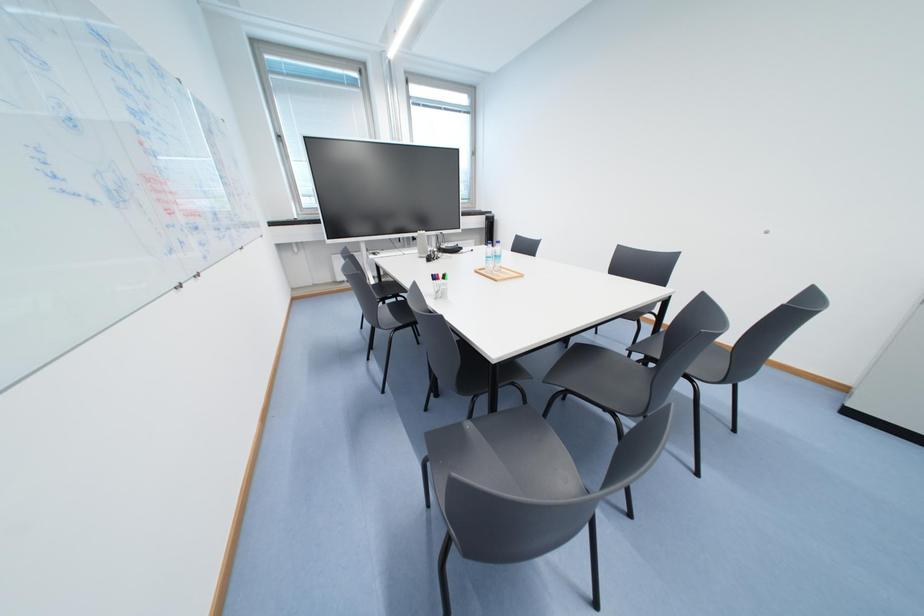
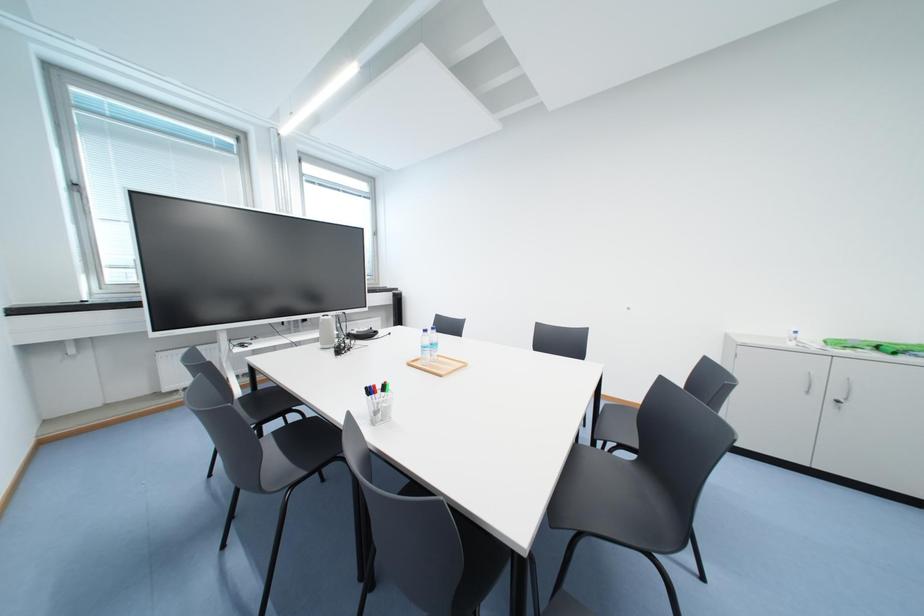
Question: The camera is either moving clockwise (left) or counter-clockwise (right) around the object. The first image is from the beginning of the video and the second image is from the end. Is the camera moving left or right when shooting the video?

Choices:
 (A) Left
 (B) Right

Answer: (A)